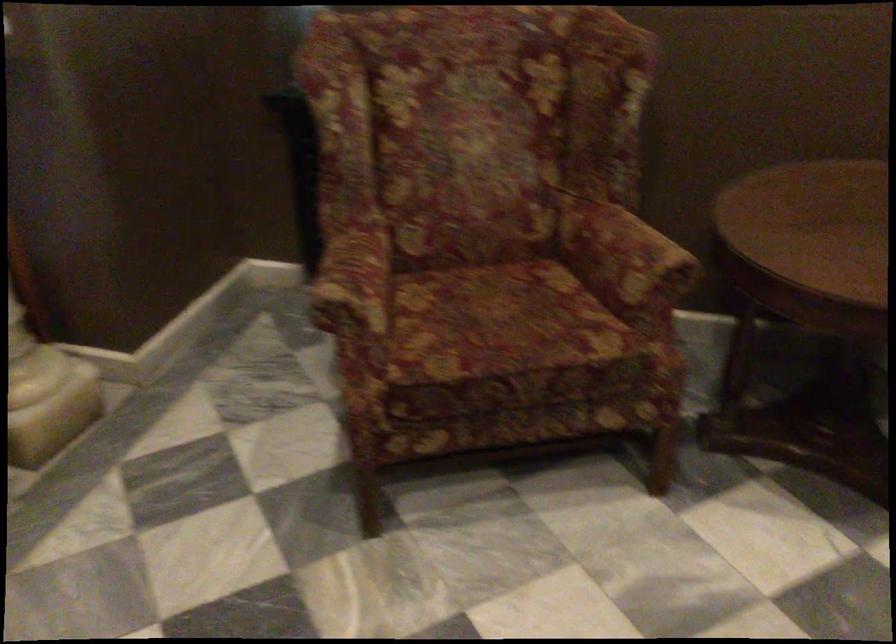
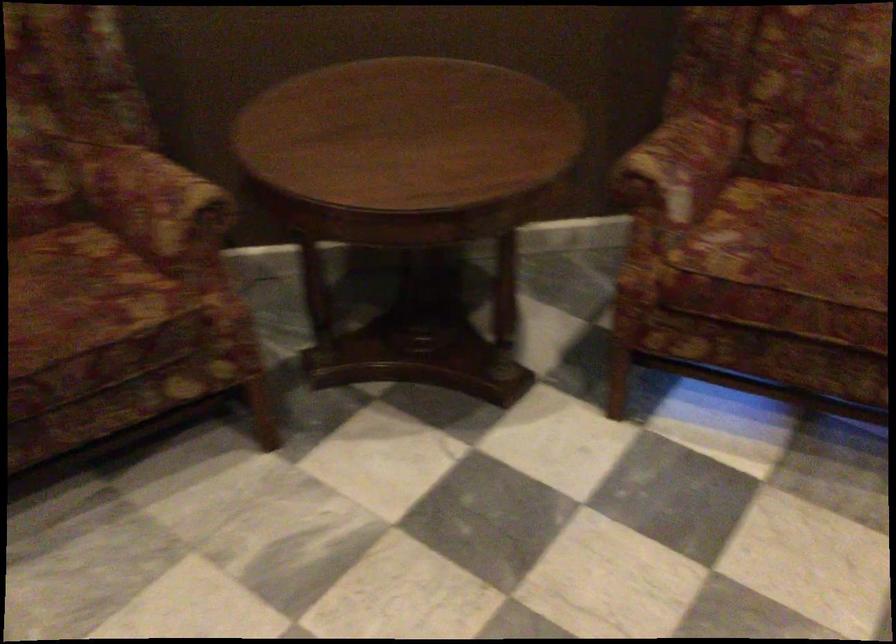
The point at (626, 254) is marked in the first image. Where is the corresponding point in the second image?

(156, 204)